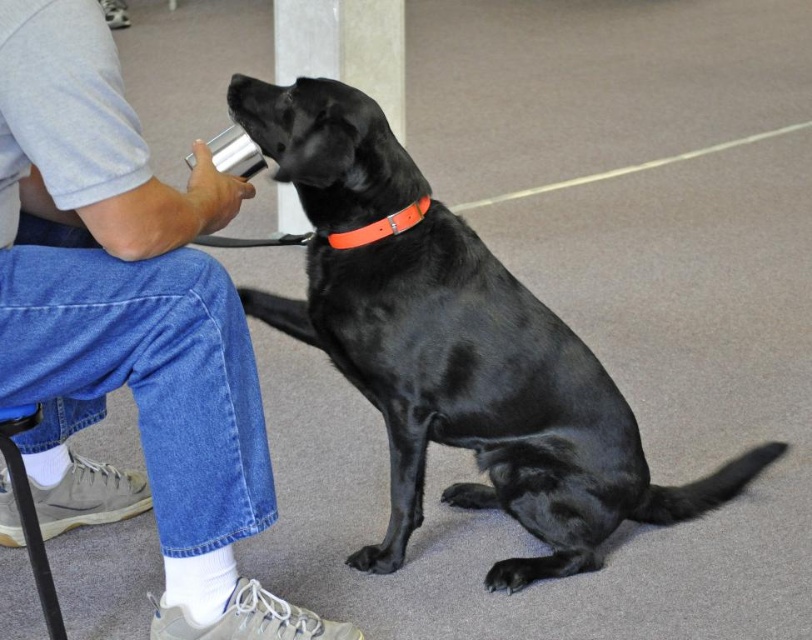
Is point (71, 381) positioned before point (275, 150)?

Yes, point (71, 381) is in front of point (275, 150).

Between point (240, 620) and point (577, 346), which one is positioned behind?

The point (577, 346) is more distant.

The width and height of the screenshot is (812, 640). Find the location of `gray cotton shirt at upper left`. gray cotton shirt at upper left is located at coordinates (128, 326).